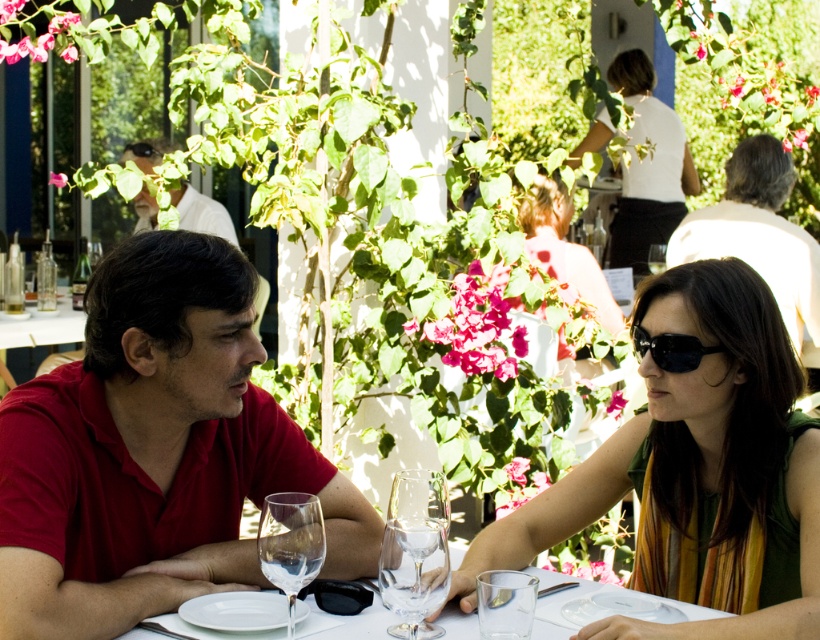
Consider the image. You are a customer at the outdoor dining area and want to place your black matte sunglasses at upper right and black plastic goggles at center on the table without overlapping them. Which object should you place closer to the edge of the table to prevent them from falling off?

The black matte sunglasses at upper right has a greater height compared to the black plastic goggles at center. To prevent them from falling off, place the taller black matte sunglasses at upper right closer to the edge since taller objects are more stable when placed near the edge.

You are a waiter at the outdoor dining area. You need to choose a wine glass that is less likely to tip over. Which one would you choose between the transparent glass wine glass at center and the transparent glass wine glass at lower center?

The transparent glass wine glass at lower center is thicker than the transparent glass wine glass at center, so it is less likely to tip over and should be chosen.

You are a photographer standing at the scene. You want to take a photo that includes both the matte red shirt at center and the white shirt at upper left. The camera has a 50mm lens which has a maximum focus distance of 10 feet. Will both shirts be in focus?

The matte red shirt at center is 10.16 feet away from the white shirt at upper left. Since the maximum focus distance is 10 feet, the distance between them exceeds this limit, so both shirts cannot be in focus simultaneously.